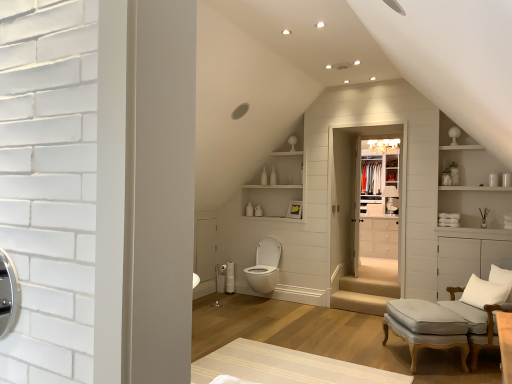
Locate an element on the screen. vacant space that is to the left of light gray fabric stool at lower right is located at coordinates (365, 358).